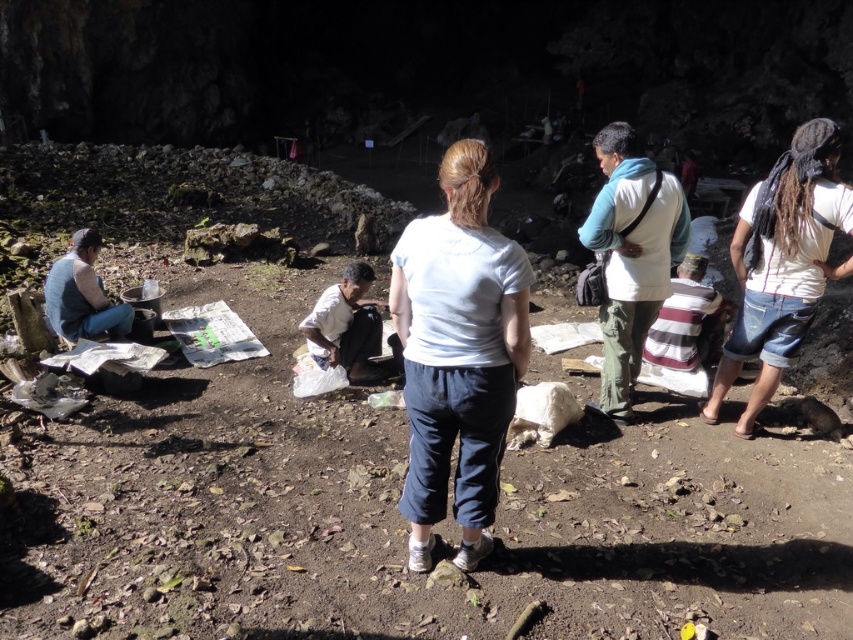
Can you confirm if white cotton shirt at center is taller than white fabric bag at center?

Indeed, white cotton shirt at center has a greater height compared to white fabric bag at center.

Can you confirm if white cotton shirt at center is smaller than white fabric bag at center?

No, white cotton shirt at center is not smaller than white fabric bag at center.

Measure the distance between point (439, 241) and camera.

Point (439, 241) and camera are 9.26 feet apart from each other.

Where is `white cotton shirt at center`? Image resolution: width=853 pixels, height=640 pixels. white cotton shirt at center is located at coordinates (457, 353).

Does white cotton shirt at right lie behind white fabric bag at center?

No, it is in front of white fabric bag at center.

How much distance is there between white cotton shirt at right and white fabric bag at center?

white cotton shirt at right and white fabric bag at center are 8.22 feet apart from each other.

Is point (763, 340) closer to camera compared to point (357, 336)?

That is True.

Where is `white cotton shirt at right`? This screenshot has width=853, height=640. white cotton shirt at right is located at coordinates (782, 262).

Is white cotton shirt at center positioned in front of white cotton shirt at right?

Yes, white cotton shirt at center is closer to the viewer.

Between point (425, 397) and point (769, 394), which one is positioned behind?

Point (769, 394)

The width and height of the screenshot is (853, 640). What do you see at coordinates (457, 353) in the screenshot? I see `white cotton shirt at center` at bounding box center [457, 353].

You are a GUI agent. You are given a task and a screenshot of the screen. Output one action in this format:
    pyautogui.click(x=<x>, y=<y>)
    Task: Click on the white cotton shirt at center
    
    Given the screenshot: What is the action you would take?
    pyautogui.click(x=457, y=353)